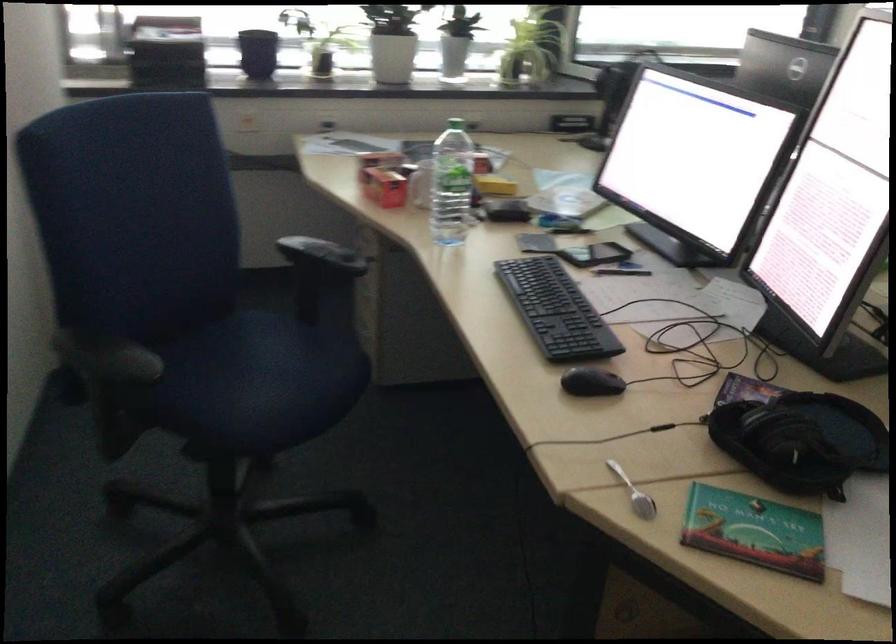
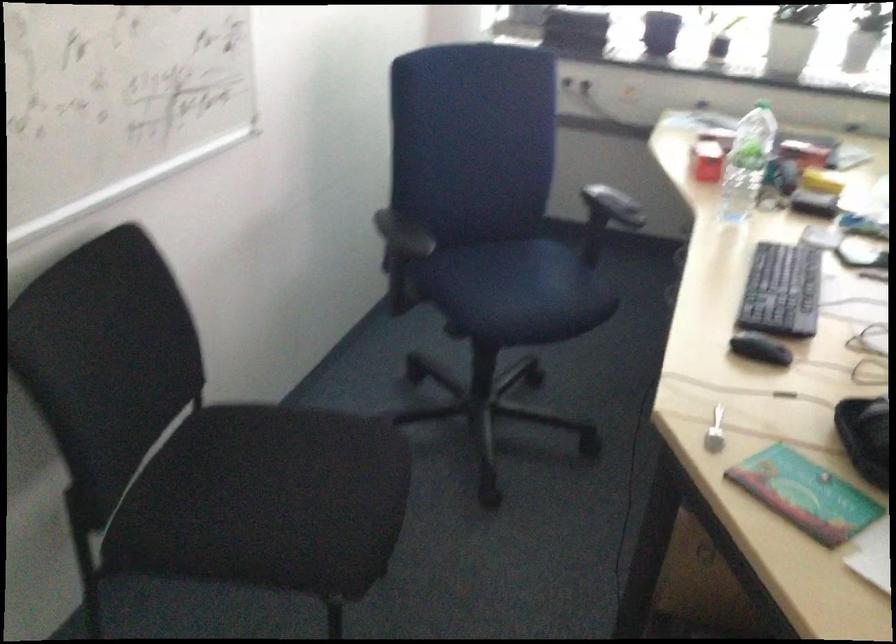
The point at [455,126] is marked in the first image. Where is the corresponding point in the second image?

(763, 102)